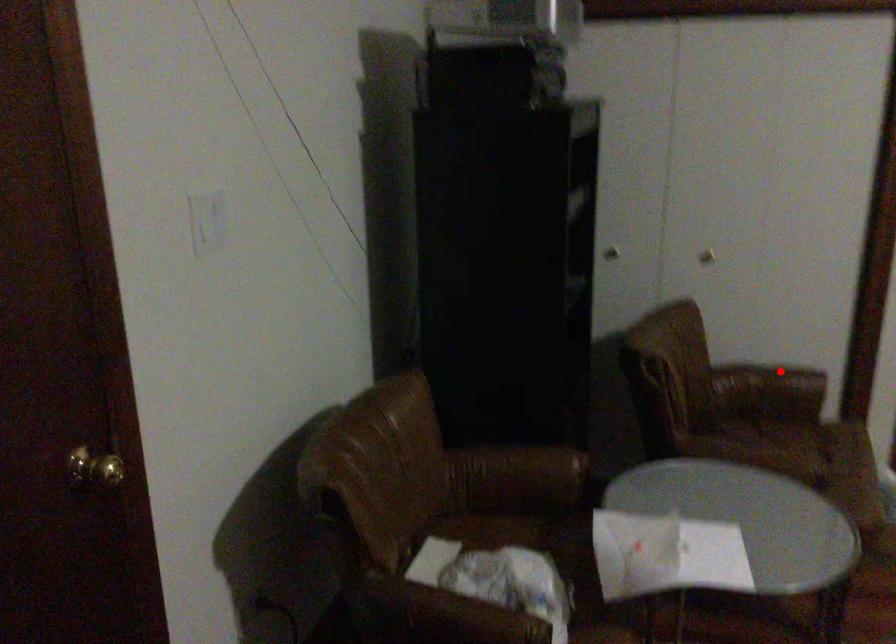
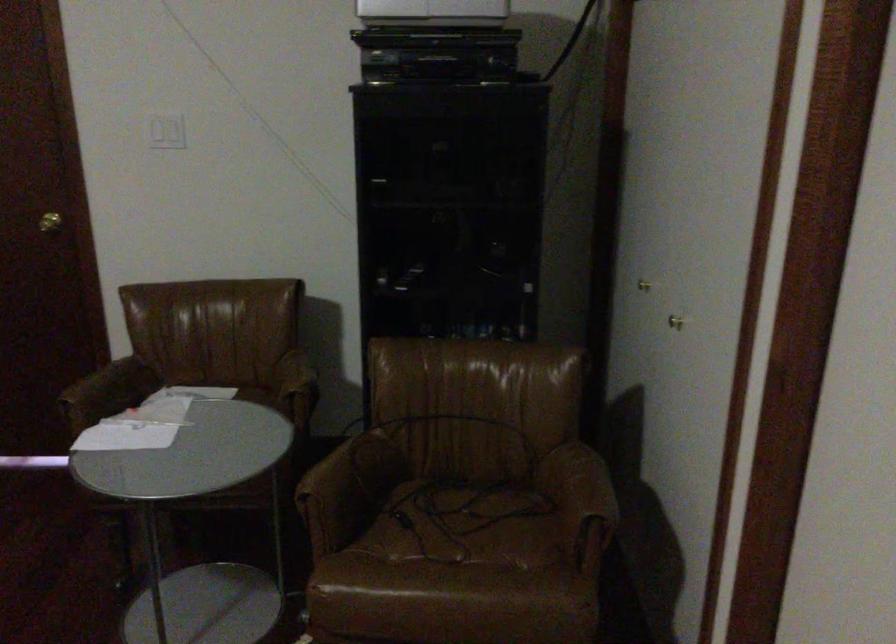
Question: I am providing you with two images of the same scene from different viewpoints. Image1 has a red point marked. In image2, the corresponding 3D location appears at what relative position? Reply with the corresponding letter.

Choices:
 (A) Closer
 (B) Farther

Answer: (A)